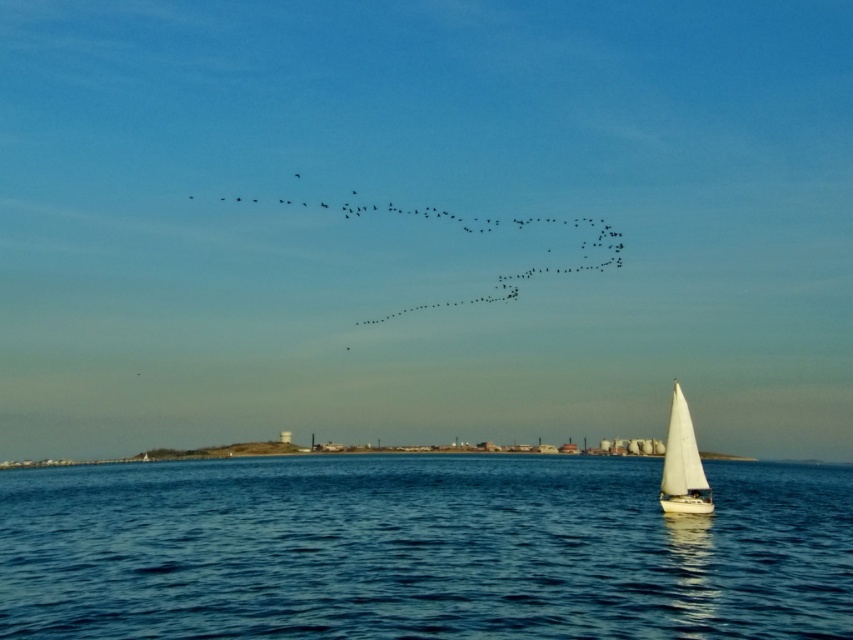
You are a photographer trying to capture the white sailboat at lower right in your shot. You want to ensure that the blue water at center takes up more of the frame than the sailboat. Based on the scene, will this be possible?

The blue water at center is larger in size than the white sailboat at lower right, so yes, it will naturally take up more of the frame, allowing the photographer to achieve the desired composition.

You are standing on the deck of the sailboat towards the right side of the frame. You notice a point marked at coordinates (480, 234). What object is located at this point?

The point at (480, 234) marks black matte birds at upper center.

You are a birdwatcher observing the black matte birds at upper center and the white sailboat at lower right from a distance. Which object appears wider in the sky?

The black matte birds at upper center might be wider than the white sailboat at lower right.